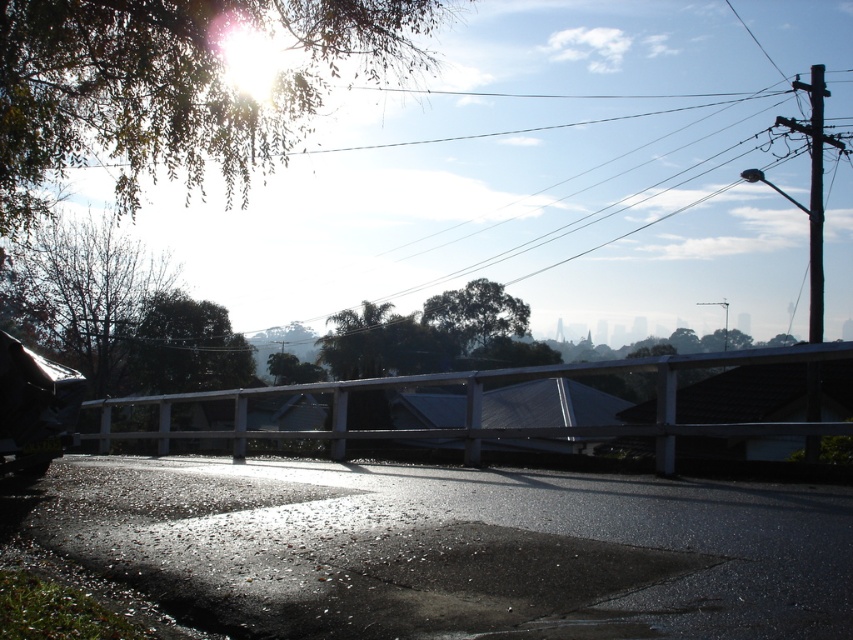
Question: Which of the following is the farthest from the observer?

Choices:
 (A) (308, 435)
 (B) (479, 291)

Answer: (B)

Question: Can you confirm if green leafy tree at upper left is wider than green leafy tree at center?

Choices:
 (A) no
 (B) yes

Answer: (B)

Question: Does brown leafy tree at left have a lesser width compared to green leafy tree at center?

Choices:
 (A) yes
 (B) no

Answer: (A)

Question: Which of the following is the closest to the observer?

Choices:
 (A) (216, 26)
 (B) (751, 426)
 (C) (451, 320)
 (D) (138, 288)

Answer: (B)

Question: Can you confirm if white wooden rail at center is positioned above brown leafy tree at left?

Choices:
 (A) yes
 (B) no

Answer: (B)

Question: Which object is positioned farthest from the green leafy tree at center?

Choices:
 (A) white wooden rail at center
 (B) brown leafy tree at left

Answer: (A)